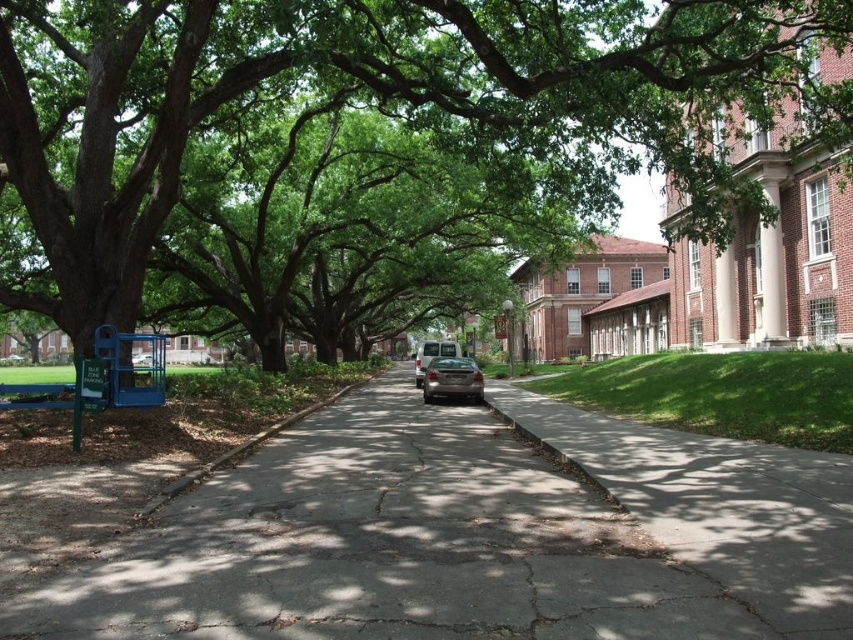
Question: Which of the following is the farthest from the observer?

Choices:
 (A) (440, 346)
 (B) (57, 157)
 (C) (219, 464)

Answer: (A)

Question: Estimate the real-world distances between objects in this image. Which object is closer to the gray asphalt pavement at center?

Choices:
 (A) metallic silver van at center
 (B) gray concrete curb at center
 (C) green leafy tree at left
 (D) satin black sedan at center

Answer: (B)

Question: Considering the real-world distances, which object is farthest from the gray concrete curb at center?

Choices:
 (A) satin black sedan at center
 (B) green leafy tree at left
 (C) metallic silver van at center
 (D) gray asphalt pavement at center

Answer: (A)

Question: Can you confirm if gray asphalt pavement at center is positioned below satin black sedan at center?

Choices:
 (A) no
 (B) yes

Answer: (B)

Question: Does white smooth column at upper right lie behind metallic silver van at center?

Choices:
 (A) no
 (B) yes

Answer: (A)

Question: Does green leafy tree at left have a smaller size compared to gray concrete curb at center?

Choices:
 (A) no
 (B) yes

Answer: (A)